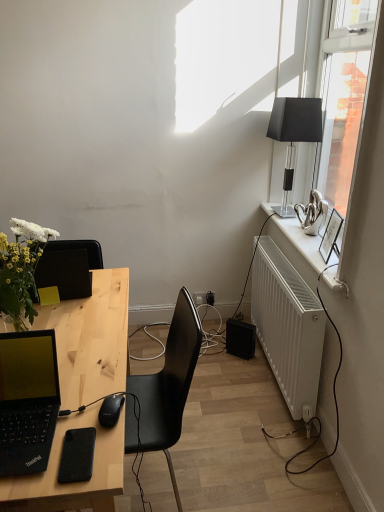
Find the location of a particular element. This screenshot has height=512, width=384. free point above natural wood desk at center (from a real-world perspective) is located at coordinates [74, 358].